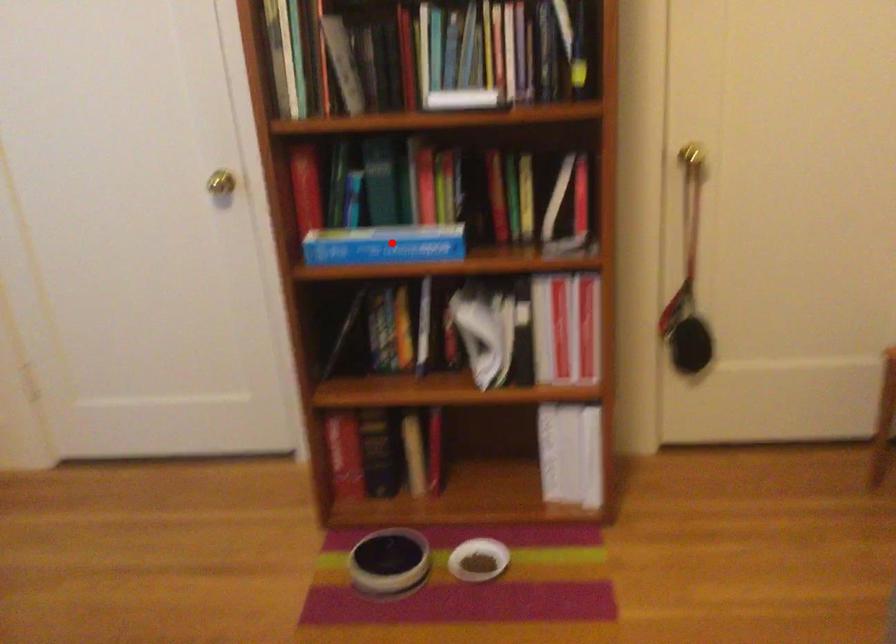
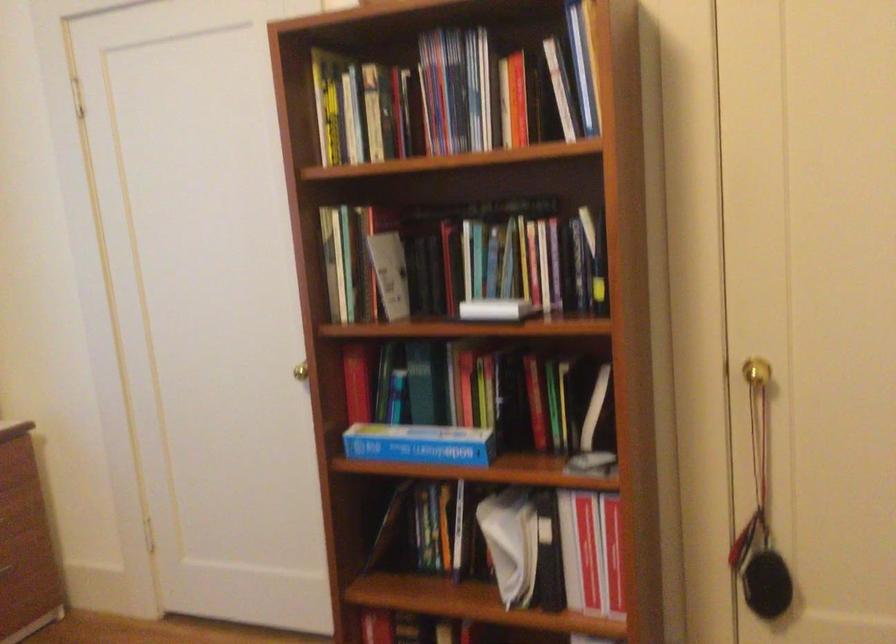
Where in the second image is the point corresponding to the highlighted location from the first image?

(419, 444)